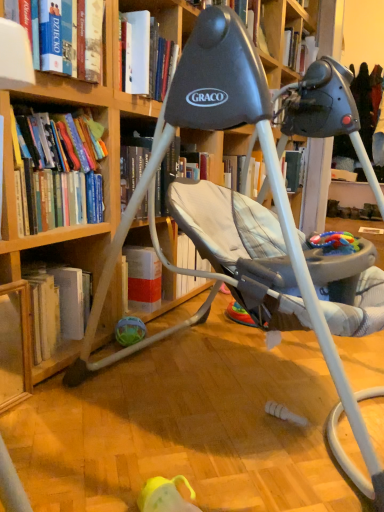
Locate an element on the screen. The width and height of the screenshot is (384, 512). vacant area that lies to the right of translucent plastic ball at lower center, the 1th toy positioned from the left is located at coordinates (181, 347).